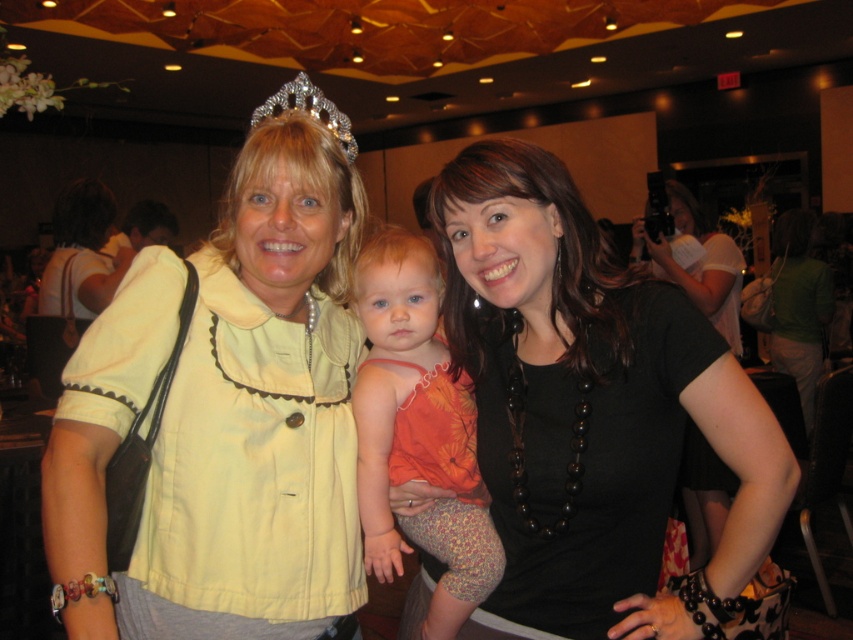
Question: Which point appears farthest from the camera in this image?

Choices:
 (A) (444, 193)
 (B) (271, 100)
 (C) (427, 448)

Answer: (C)

Question: Can you confirm if yellow fabric at center is positioned to the left of orange fabric dress at center?

Choices:
 (A) no
 (B) yes

Answer: (B)

Question: Which point appears closest to the camera in this image?

Choices:
 (A) (695, 621)
 (B) (434, 378)
 (C) (236, 321)

Answer: (A)

Question: Does black matte necklace at center appear on the left side of orange fabric dress at center?

Choices:
 (A) yes
 (B) no

Answer: (B)

Question: Can you confirm if black matte necklace at center is bigger than orange fabric dress at center?

Choices:
 (A) no
 (B) yes

Answer: (B)

Question: Which point is closer to the camera?

Choices:
 (A) orange fabric dress at center
 (B) sparkling silver tiara at upper center
 (C) black matte necklace at center

Answer: (C)